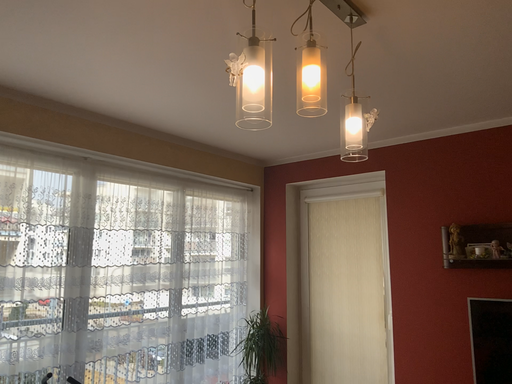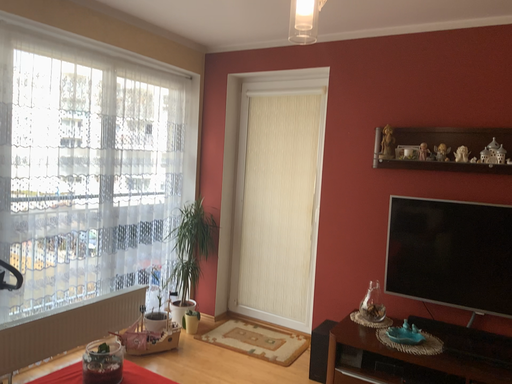
Question: Which way did the camera rotate in the video?

Choices:
 (A) rotated upward
 (B) rotated downward

Answer: (B)